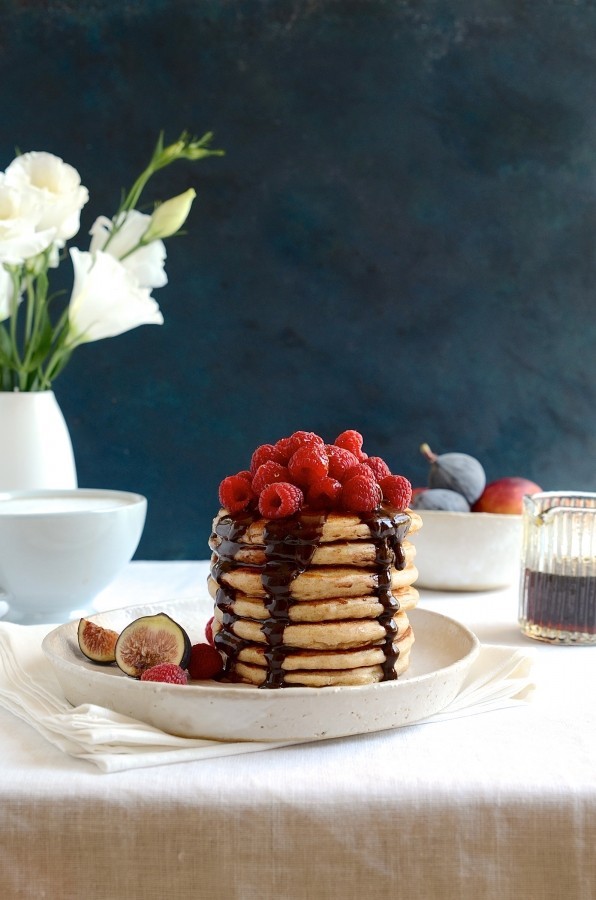
At what (x,y) coordinates should I click in order to perform the action: click on napkin. Please return your answer as a coordinate pair (x, y). Looking at the image, I should click on (83, 717), (103, 759), (95, 747), (95, 734), (35, 679).